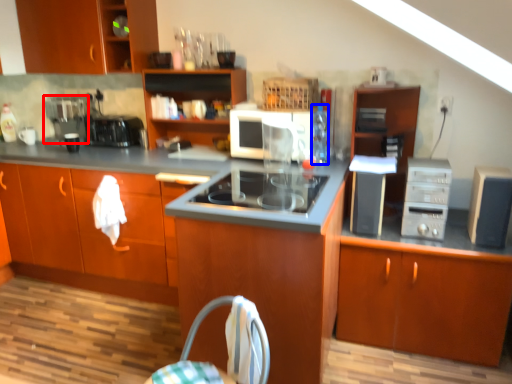
Question: Which object is further to the camera taking this photo, coffee machine (highlighted by a red box) or bottle (highlighted by a blue box)?

Choices:
 (A) coffee machine
 (B) bottle

Answer: (A)